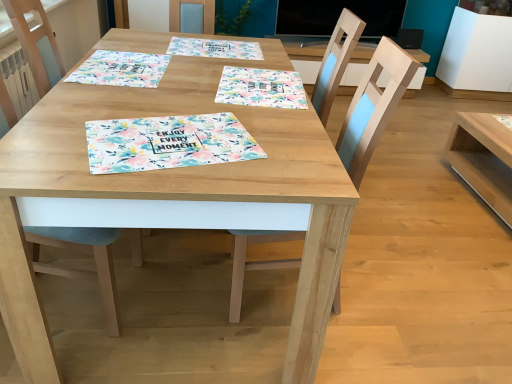
The image size is (512, 384). I want to click on free space behind floral paper placemat at center, so click(193, 99).